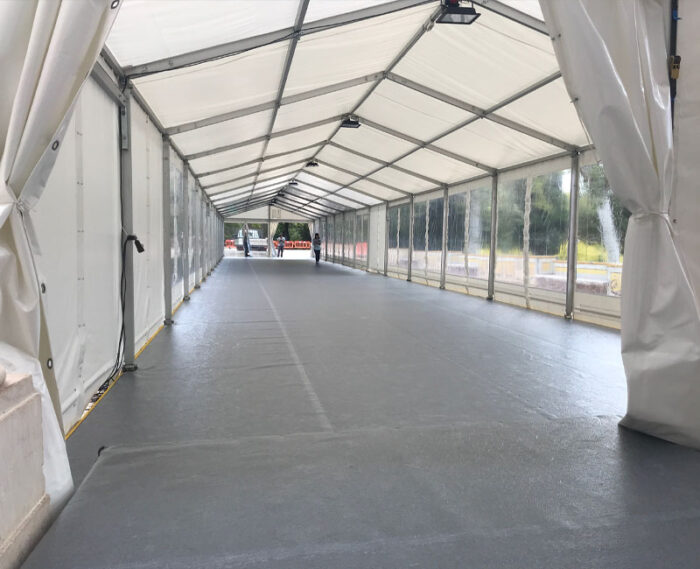
You are a GUI agent. You are given a task and a screenshot of the screen. Output one action in this format:
    pyautogui.click(x=<x>, y=<y>)
    Task: Click on the grommets
    
    Given the screenshot: What is the action you would take?
    pyautogui.click(x=48, y=362), pyautogui.click(x=43, y=288), pyautogui.click(x=54, y=144)